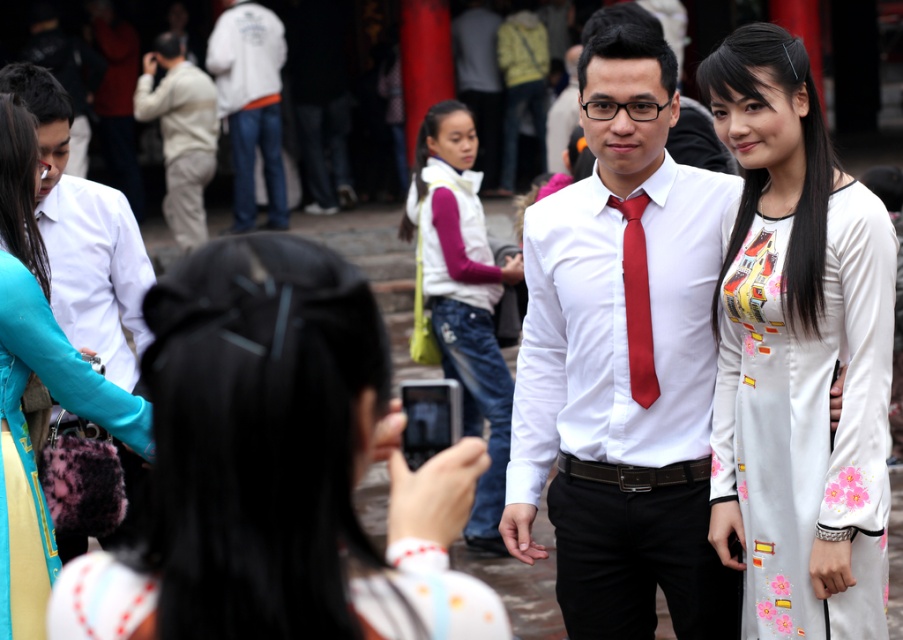
You are a photographer trying to capture both the white glossy shirt at center and the white silk dress at center in a single frame. Which object should you focus on first to ensure both are in the shot?

The white glossy shirt at center is positioned under the white silk dress at center, so you should focus on the white silk dress at center first to ensure both are in the shot.

You are standing at the point labeled point (x=7, y=212) and want to take a photo of the camera. Is the camera within your camera range?

The point labeled point (x=7, y=212) is 10.74 meters away from the camera. If your camera has a range of at least 10.74 meters, then yes, you can take a photo of the camera from that point. Otherwise, you need to move closer.

You are a photographer trying to capture a clear image of both the white cotton dress at center and the matte red tie at center. Based on their positions, which one is closer to the camera?

The white cotton dress at center is in front of the matte red tie at center, so it is closer to the camera.